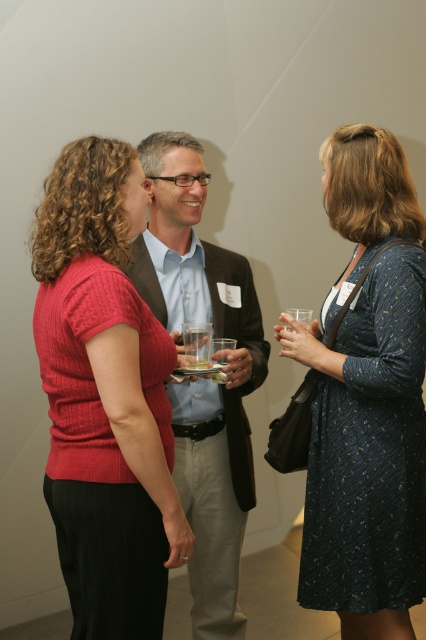
Does matte red sweater at left appear on the left side of blue textured dress at right?

Indeed, matte red sweater at left is positioned on the left side of blue textured dress at right.

Between matte red sweater at left and blue textured dress at right, which one is positioned higher?

matte red sweater at left

Measure the distance between matte red sweater at left and camera.

They are 1.51 meters apart.

The width and height of the screenshot is (426, 640). Find the location of `matte red sweater at left`. matte red sweater at left is located at coordinates (104, 397).

Image resolution: width=426 pixels, height=640 pixels. What do you see at coordinates (367, 397) in the screenshot?
I see `blue textured dress at right` at bounding box center [367, 397].

Where is `blue textured dress at right`? The width and height of the screenshot is (426, 640). blue textured dress at right is located at coordinates (367, 397).

This screenshot has height=640, width=426. I want to click on blue textured dress at right, so click(x=367, y=397).

Between matte black suit at center and clear glass at center, which one is positioned higher?

clear glass at center is higher up.

Locate an element on the screen. The height and width of the screenshot is (640, 426). matte black suit at center is located at coordinates (203, 378).